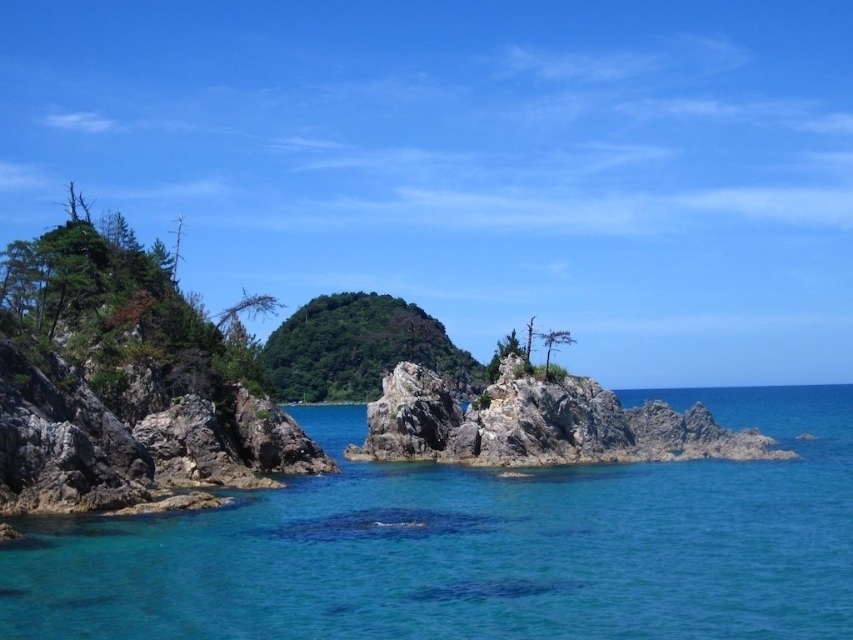
Question: Among these objects, which one is farthest from the camera?

Choices:
 (A) clear blue water at center
 (B) green matte tree at left

Answer: (B)

Question: Based on their relative distances, which object is farther from the green matte tree at center?

Choices:
 (A) clear blue water at center
 (B) green leafy tree at center
 (C) rocky at center

Answer: (B)

Question: Is clear blue water at center above rocky at center?

Choices:
 (A) yes
 (B) no

Answer: (B)

Question: Does rocky at center appear under green matte tree at left?

Choices:
 (A) yes
 (B) no

Answer: (A)

Question: Among these points, which one is nearest to the camera?

Choices:
 (A) (558, 339)
 (B) (618, 452)

Answer: (B)

Question: From the image, what is the correct spatial relationship of rocky at center in relation to green matte tree at center?

Choices:
 (A) left
 (B) right

Answer: (B)